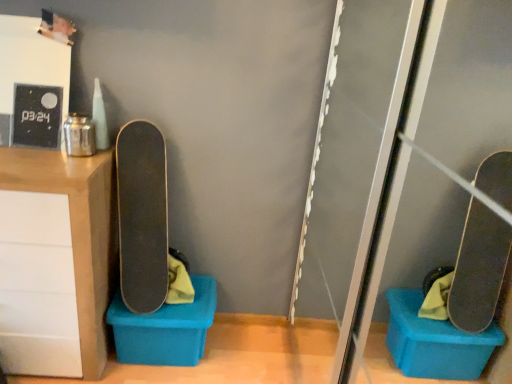
Question: Is matte wood cabinet at left turned away from blue plastic storage box at lower left?

Choices:
 (A) yes
 (B) no

Answer: (B)

Question: Are matte wood cabinet at left and blue plastic storage box at lower left far apart?

Choices:
 (A) no
 (B) yes

Answer: (A)

Question: Can you confirm if matte wood cabinet at left is smaller than blue plastic storage box at lower left?

Choices:
 (A) yes
 (B) no

Answer: (B)

Question: From a real-world perspective, is matte wood cabinet at left located higher than blue plastic storage box at lower left?

Choices:
 (A) no
 (B) yes

Answer: (B)

Question: Is matte wood cabinet at left thinner than blue plastic storage box at lower left?

Choices:
 (A) yes
 (B) no

Answer: (B)

Question: Is blue plastic storage box at lower left taller or shorter than smooth black skateboard at center?

Choices:
 (A) tall
 (B) short

Answer: (B)

Question: Considering the positions of point (135, 317) and point (161, 183), is point (135, 317) closer or farther from the camera than point (161, 183)?

Choices:
 (A) closer
 (B) farther

Answer: (A)

Question: Is blue plastic storage box at lower left wider or thinner than smooth black skateboard at center?

Choices:
 (A) wide
 (B) thin

Answer: (A)

Question: Is blue plastic storage box at lower left situated inside smooth black skateboard at center or outside?

Choices:
 (A) outside
 (B) inside

Answer: (A)

Question: In terms of width, does smooth black skateboard at center look wider or thinner when compared to matte wood cabinet at left?

Choices:
 (A) wide
 (B) thin

Answer: (B)

Question: Is smooth black skateboard at center taller or shorter than matte wood cabinet at left?

Choices:
 (A) short
 (B) tall

Answer: (A)

Question: Looking at the image, does smooth black skateboard at center seem bigger or smaller compared to matte wood cabinet at left?

Choices:
 (A) big
 (B) small

Answer: (B)

Question: From a real-world perspective, is smooth black skateboard at center positioned above or below matte wood cabinet at left?

Choices:
 (A) above
 (B) below

Answer: (A)

Question: In terms of size, does matte wood cabinet at left appear bigger or smaller than blue plastic storage box at lower left?

Choices:
 (A) big
 (B) small

Answer: (A)

Question: In terms of height, does matte wood cabinet at left look taller or shorter compared to blue plastic storage box at lower left?

Choices:
 (A) tall
 (B) short

Answer: (A)